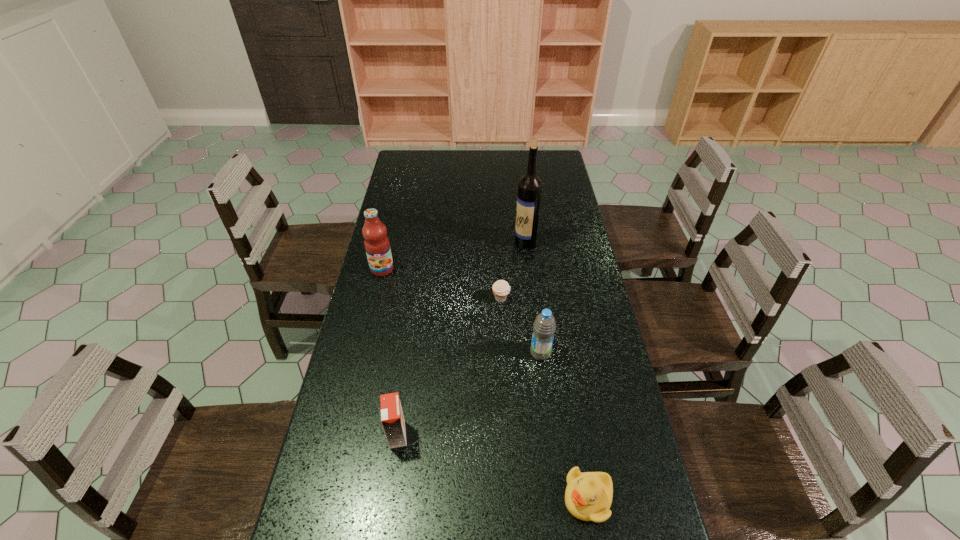
Where is `vacant space located 0.130m on the back of the fourth object from right to left`? This screenshot has width=960, height=540. vacant space located 0.130m on the back of the fourth object from right to left is located at coordinates pos(499,266).

Where is `fruit juice positioned at the left edge`? fruit juice positioned at the left edge is located at coordinates (377, 245).

Identify the location of orange juice at the left edge. (392, 418).

In order to click on object at the right edge in this screenshot , I will do `click(588, 496)`.

In the image, there is a desktop. Find the location of `vacant area at the far edge`. vacant area at the far edge is located at coordinates (518, 167).

In the image, there is a desktop. Identify the location of vacant space at the left edge. (x=404, y=215).

The height and width of the screenshot is (540, 960). I want to click on vacant space at the right edge of the desktop, so click(561, 194).

This screenshot has width=960, height=540. Identify the location of free space at the far left corner. (409, 161).

Where is `free spot between the leftmost object and the duckling`? Image resolution: width=960 pixels, height=540 pixels. free spot between the leftmost object and the duckling is located at coordinates (485, 384).

You are a GUI agent. You are given a task and a screenshot of the screen. Output one action in this format:
    pyautogui.click(x=<x>, y=<y>)
    Task: Click on the vacant area between the nearest object and the wine bottle
    This screenshot has width=960, height=540.
    Given the screenshot: What is the action you would take?
    pyautogui.click(x=557, y=370)